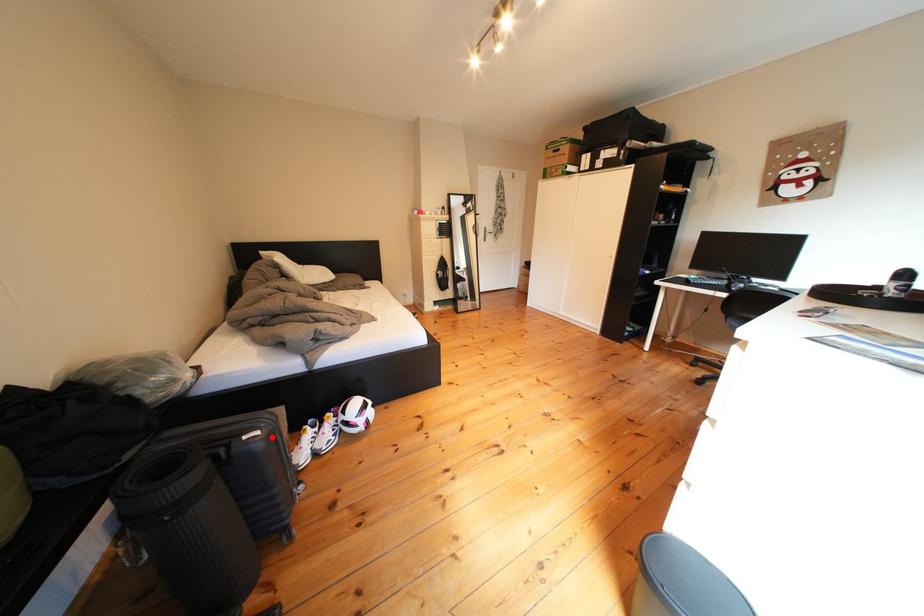
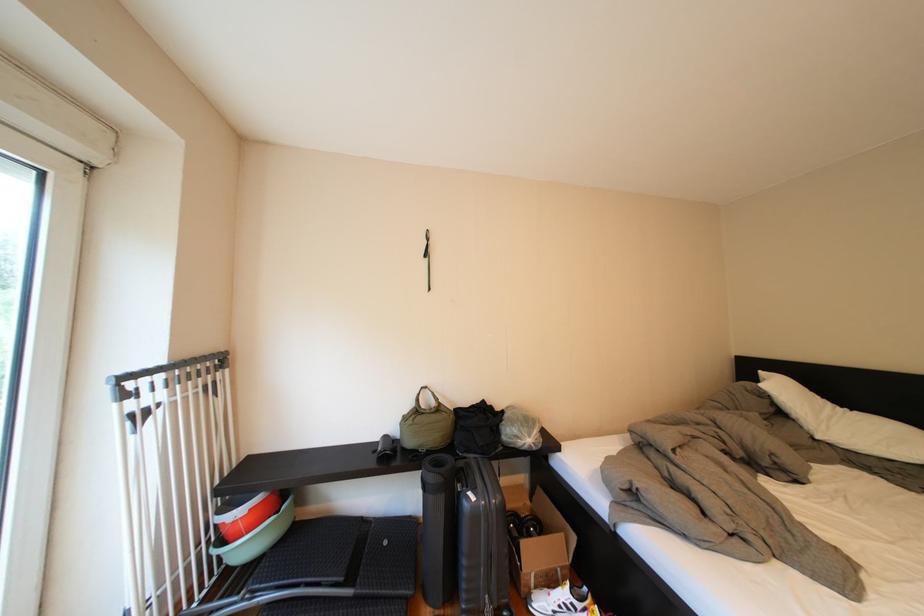
In the second image, find the point that corresponds to the highlighted location in the first image.

(487, 503)